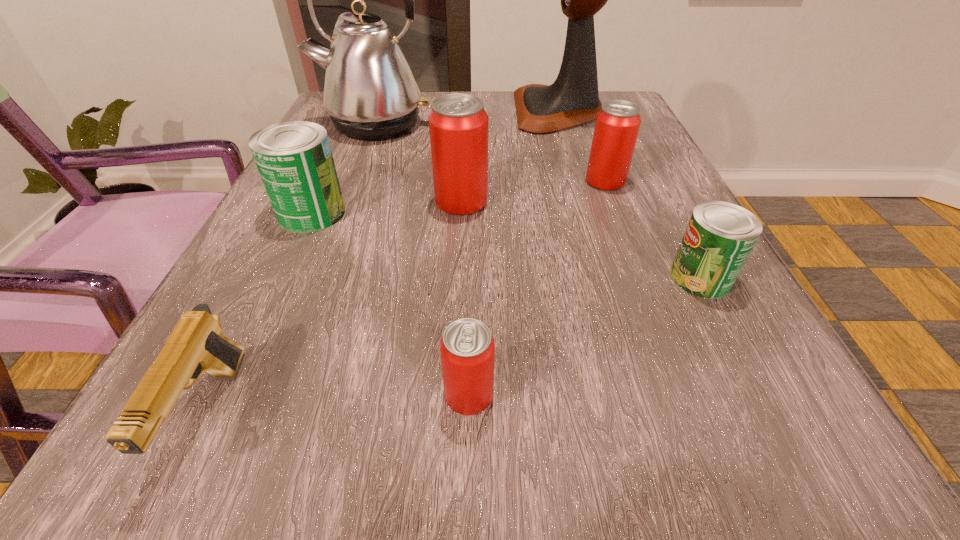
Where is `brown fan`? This screenshot has height=540, width=960. brown fan is located at coordinates (573, 99).

You are a GUI agent. You are given a task and a screenshot of the screen. Output one action in this format:
    pyautogui.click(x=<x>, y=<y>)
    Task: Click on the tallest object
    The height and width of the screenshot is (540, 960).
    Given the screenshot: What is the action you would take?
    pyautogui.click(x=573, y=99)

I want to click on the second tallest object, so click(x=370, y=92).

The width and height of the screenshot is (960, 540). Find the location of `the sixth shortest object`. the sixth shortest object is located at coordinates (458, 124).

Identify the location of the biggest red can. (458, 124).

Locate an element on the screen. This screenshot has height=540, width=960. the rightmost red can is located at coordinates (618, 122).

The width and height of the screenshot is (960, 540). I want to click on the second biggest red can, so (618, 122).

Identify the location of the farther green can. The image size is (960, 540). (294, 159).

The image size is (960, 540). Find the location of `the bigger green can`. the bigger green can is located at coordinates (294, 159).

Image resolution: width=960 pixels, height=540 pixels. Find the location of `the nearer green can`. the nearer green can is located at coordinates (719, 237).